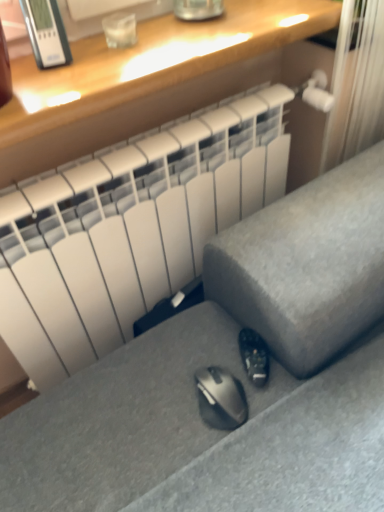
Question: Considering the relative sizes of satin gray sofa at lower center and matte wood desk at upper center in the image provided, is satin gray sofa at lower center taller than matte wood desk at upper center?

Choices:
 (A) yes
 (B) no

Answer: (A)

Question: Considering the relative positions of satin gray sofa at lower center and matte wood desk at upper center in the image provided, is satin gray sofa at lower center in front of matte wood desk at upper center?

Choices:
 (A) no
 (B) yes

Answer: (B)

Question: Does satin gray sofa at lower center appear on the right side of matte wood desk at upper center?

Choices:
 (A) yes
 (B) no

Answer: (A)

Question: Can you confirm if satin gray sofa at lower center is positioned to the left of matte wood desk at upper center?

Choices:
 (A) no
 (B) yes

Answer: (A)

Question: Is satin gray sofa at lower center positioned beyond the bounds of matte wood desk at upper center?

Choices:
 (A) no
 (B) yes

Answer: (B)

Question: Is satin gray sofa at lower center oriented towards matte wood desk at upper center?

Choices:
 (A) yes
 (B) no

Answer: (B)

Question: From the image's perspective, is black matte shoe at lower center on satin gray sofa at lower center?

Choices:
 (A) no
 (B) yes

Answer: (A)

Question: Is black matte shoe at lower center at the right side of satin gray sofa at lower center?

Choices:
 (A) yes
 (B) no

Answer: (B)

Question: Is black matte shoe at lower center at the left side of satin gray sofa at lower center?

Choices:
 (A) yes
 (B) no

Answer: (A)

Question: Are black matte shoe at lower center and satin gray sofa at lower center located far from each other?

Choices:
 (A) yes
 (B) no

Answer: (B)

Question: Can you confirm if black matte shoe at lower center is wider than satin gray sofa at lower center?

Choices:
 (A) yes
 (B) no

Answer: (B)

Question: Considering the relative positions of black matte shoe at lower center and satin gray sofa at lower center in the image provided, is black matte shoe at lower center in front of satin gray sofa at lower center?

Choices:
 (A) yes
 (B) no

Answer: (B)

Question: Does black matte shoe at lower center have a greater height compared to matte wood desk at upper center?

Choices:
 (A) yes
 (B) no

Answer: (B)